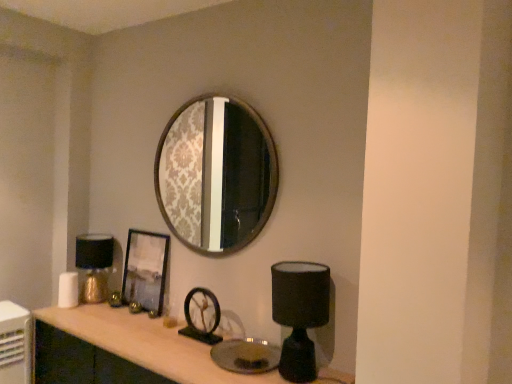
Locate an element on the screen. This screenshot has height=384, width=512. metallic silver picture frame at center is located at coordinates (145, 271).

Where is `wooden frame mirror at upper center`? wooden frame mirror at upper center is located at coordinates (216, 174).

The image size is (512, 384). What do you see at coordinates (94, 265) in the screenshot? I see `gold metallic table lamp at left, positioned as the first table lamp in back-to-front order` at bounding box center [94, 265].

Identify the location of matte wood computer desk at center. This screenshot has width=512, height=384. (147, 344).

Does gold metallic table lamp at left, which is the 2th table lamp from front to back, touch metallic silver picture frame at center?

No, gold metallic table lamp at left, which is the 2th table lamp from front to back, is not making contact with metallic silver picture frame at center.

Consider the image. Considering the relative positions of gold metallic table lamp at left, which is the 2th table lamp from front to back, and metallic silver picture frame at center in the image provided, is gold metallic table lamp at left, which is the 2th table lamp from front to back, to the right of metallic silver picture frame at center from the viewer's perspective?

Incorrect, gold metallic table lamp at left, which is the 2th table lamp from front to back, is not on the right side of metallic silver picture frame at center.

Can you tell me how much gold metallic table lamp at left, placed as the 2th table lamp when sorted from right to left, and metallic silver picture frame at center differ in facing direction?

They differ by 0.0232 degrees in their facing directions.

Which is nearer, (163, 259) or (202, 127)?

Point (163, 259)

Is metallic silver picture frame at center oriented away from wooden frame mirror at upper center?

metallic silver picture frame at center is not turned away from wooden frame mirror at upper center.

There is a metallic silver picture frame at center. At what (x,y) coordinates should I click in order to perform the action: click on mirror above it (from a real-world perspective). Please return your answer as a coordinate pair (x, y). This screenshot has height=384, width=512. Looking at the image, I should click on (216, 174).

Is metallic silver picture frame at center far from wooden frame mirror at upper center?

metallic silver picture frame at center is positioned a significant distance from wooden frame mirror at upper center.

Based on their sizes in the image, would you say black matte table lamp at lower right, placed as the 1th table lamp when sorted from front to back, is bigger or smaller than metallic silver picture frame at center?

In the image, black matte table lamp at lower right, placed as the 1th table lamp when sorted from front to back, appears to be larger than metallic silver picture frame at center.

The width and height of the screenshot is (512, 384). In order to click on table lamp above the metallic silver picture frame at center (from a real-world perspective) in this screenshot , I will do `click(298, 314)`.

Is black matte table lamp at lower right, which ranks as the second table lamp in back-to-front order, next to metallic silver picture frame at center and touching it?

No, black matte table lamp at lower right, which ranks as the second table lamp in back-to-front order, is not making contact with metallic silver picture frame at center.

From the picture: Is black matte table lamp at lower right, placed as the 1th table lamp when sorted from front to back, thinner than metallic silver picture frame at center?

No, black matte table lamp at lower right, placed as the 1th table lamp when sorted from front to back, is not thinner than metallic silver picture frame at center.

From the image's perspective, is black matte table lamp at lower right, which ranks as the second table lamp in back-to-front order, located above or below gold metallic table lamp at left, which is the 2th table lamp from front to back?

black matte table lamp at lower right, which ranks as the second table lamp in back-to-front order, is below gold metallic table lamp at left, which is the 2th table lamp from front to back.

Consider the image. Considering the relative sizes of black matte table lamp at lower right, the 2th table lamp in the left-to-right sequence, and gold metallic table lamp at left, placed as the 2th table lamp when sorted from right to left, in the image provided, is black matte table lamp at lower right, the 2th table lamp in the left-to-right sequence, smaller than gold metallic table lamp at left, placed as the 2th table lamp when sorted from right to left,?

No.

How many degrees apart are the facing directions of black matte table lamp at lower right, acting as the first table lamp starting from the right, and gold metallic table lamp at left, positioned as the first table lamp in back-to-front order?

black matte table lamp at lower right, acting as the first table lamp starting from the right, and gold metallic table lamp at left, positioned as the first table lamp in back-to-front order, are facing 0.00372 degrees away from each other.

Is point (306, 309) positioned before point (94, 292)?

Yes, it is.

Considering the positions of points (121, 310) and (79, 256), is point (121, 310) farther from camera compared to point (79, 256)?

No, it is not.

Are matte wood computer desk at center and gold metallic table lamp at left, positioned as the first table lamp in back-to-front order, far apart?

A: No, matte wood computer desk at center is not far from gold metallic table lamp at left, positioned as the first table lamp in back-to-front order.

Is matte wood computer desk at center smaller than gold metallic table lamp at left, placed as the 2th table lamp when sorted from right to left?

No.

Looking at this image, from the image's perspective, would you say matte wood computer desk at center is shown under gold metallic table lamp at left, positioned as the first table lamp in back-to-front order?

Correct, matte wood computer desk at center appears lower than gold metallic table lamp at left, positioned as the first table lamp in back-to-front order, in the image.

What's the angular difference between wooden frame mirror at upper center and black matte table lamp at lower right, acting as the first table lamp starting from the right,'s facing directions?

The angular difference between wooden frame mirror at upper center and black matte table lamp at lower right, acting as the first table lamp starting from the right, is 0.534 degrees.

Is wooden frame mirror at upper center directly adjacent to black matte table lamp at lower right, the 2th table lamp in the left-to-right sequence?

wooden frame mirror at upper center is not next to black matte table lamp at lower right, the 2th table lamp in the left-to-right sequence, and they're not touching.

Is point (232, 133) closer or farther from the camera than point (329, 269)?

Point (232, 133) appears to be farther away from the viewer than point (329, 269).

How different are the orientations of metallic silver picture frame at center and gold metallic table lamp at left, positioned as the first table lamp in back-to-front order, in degrees?

The angular difference between metallic silver picture frame at center and gold metallic table lamp at left, positioned as the first table lamp in back-to-front order, is 0.0232 degrees.

Is metallic silver picture frame at center turned away from gold metallic table lamp at left, placed as the 2th table lamp when sorted from right to left?

No, metallic silver picture frame at center is not facing the opposite direction of gold metallic table lamp at left, placed as the 2th table lamp when sorted from right to left.

Locate an element on the screen. The width and height of the screenshot is (512, 384). table lamp lying behind the metallic silver picture frame at center is located at coordinates (94, 265).

Considering the relative sizes of metallic silver picture frame at center and gold metallic table lamp at left, the first table lamp from the left, in the image provided, is metallic silver picture frame at center taller than gold metallic table lamp at left, the first table lamp from the left,?

Indeed, metallic silver picture frame at center has a greater height compared to gold metallic table lamp at left, the first table lamp from the left.

Find the location of a particular element. The width and height of the screenshot is (512, 384). picture frame that appears on the right of gold metallic table lamp at left, the first table lamp from the left is located at coordinates (145, 271).

Locate an element on the screen. This screenshot has width=512, height=384. mirror above the metallic silver picture frame at center (from the image's perspective) is located at coordinates (216, 174).

Considering their positions, is gold metallic table lamp at left, positioned as the first table lamp in back-to-front order, positioned closer to wooden frame mirror at upper center than matte wood computer desk at center?

gold metallic table lamp at left, positioned as the first table lamp in back-to-front order, lies closer to wooden frame mirror at upper center than the other object.

Looking at the image, which one is located further to gold metallic table lamp at left, the first table lamp from the left, metallic silver picture frame at center or black matte table lamp at lower right, which ranks as the second table lamp in back-to-front order?

Based on the image, black matte table lamp at lower right, which ranks as the second table lamp in back-to-front order, appears to be further to gold metallic table lamp at left, the first table lamp from the left.

When comparing their distances from metallic silver picture frame at center, does black matte table lamp at lower right, placed as the 1th table lamp when sorted from front to back, or wooden frame mirror at upper center seem further?

wooden frame mirror at upper center.

Which object lies nearer to the anchor point black matte table lamp at lower right, the 2th table lamp in the left-to-right sequence, gold metallic table lamp at left, positioned as the first table lamp in back-to-front order, or wooden frame mirror at upper center?

The object closer to black matte table lamp at lower right, the 2th table lamp in the left-to-right sequence, is gold metallic table lamp at left, positioned as the first table lamp in back-to-front order.

Based on their spatial positions, is gold metallic table lamp at left, the first table lamp from the left, or metallic silver picture frame at center further from black matte table lamp at lower right, the 2th table lamp in the left-to-right sequence?

Based on the image, gold metallic table lamp at left, the first table lamp from the left, appears to be further to black matte table lamp at lower right, the 2th table lamp in the left-to-right sequence.

When comparing their distances from gold metallic table lamp at left, positioned as the first table lamp in back-to-front order, does matte wood computer desk at center or wooden frame mirror at upper center seem closer?

matte wood computer desk at center is positioned closer to the anchor gold metallic table lamp at left, positioned as the first table lamp in back-to-front order.

Looking at the image, which one is located closer to black matte table lamp at lower right, which ranks as the second table lamp in back-to-front order, matte wood computer desk at center or metallic silver picture frame at center?

matte wood computer desk at center.

From the image, which object appears to be farther from gold metallic table lamp at left, positioned as the first table lamp in back-to-front order, black matte table lamp at lower right, the 2th table lamp in the left-to-right sequence, or matte wood computer desk at center?

Based on the image, black matte table lamp at lower right, the 2th table lamp in the left-to-right sequence, appears to be further to gold metallic table lamp at left, positioned as the first table lamp in back-to-front order.

Identify the location of picture frame situated between gold metallic table lamp at left, placed as the 2th table lamp when sorted from right to left, and wooden frame mirror at upper center from left to right. (145, 271).

Identify the location of picture frame between gold metallic table lamp at left, which is the 2th table lamp from front to back, and black matte table lamp at lower right, placed as the 1th table lamp when sorted from front to back, from left to right. The width and height of the screenshot is (512, 384). (145, 271).

This screenshot has height=384, width=512. I want to click on table lamp between matte wood computer desk at center and metallic silver picture frame at center along the z-axis, so click(298, 314).

You are a GUI agent. You are given a task and a screenshot of the screen. Output one action in this format:
    pyautogui.click(x=<x>, y=<y>)
    Task: Click on the computer desk between gold metallic table lamp at left, which is the 2th table lamp from front to back, and black matte table lamp at lower right, the 2th table lamp in the left-to-right sequence
    Image resolution: width=512 pixels, height=384 pixels.
    Given the screenshot: What is the action you would take?
    pyautogui.click(x=147, y=344)